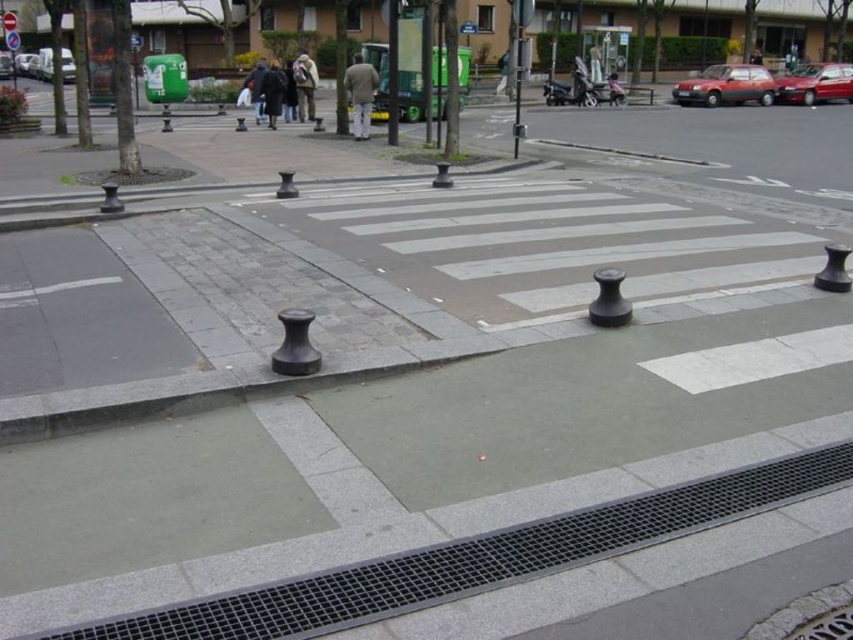
You are a delivery person trying to cross the street. You see a light brown fabric jacket at center and a dark gray jacket at center. Which jacket is closer to you?

The light brown fabric jacket at center is closer to you because it is further to the viewer than the dark gray jacket at center.